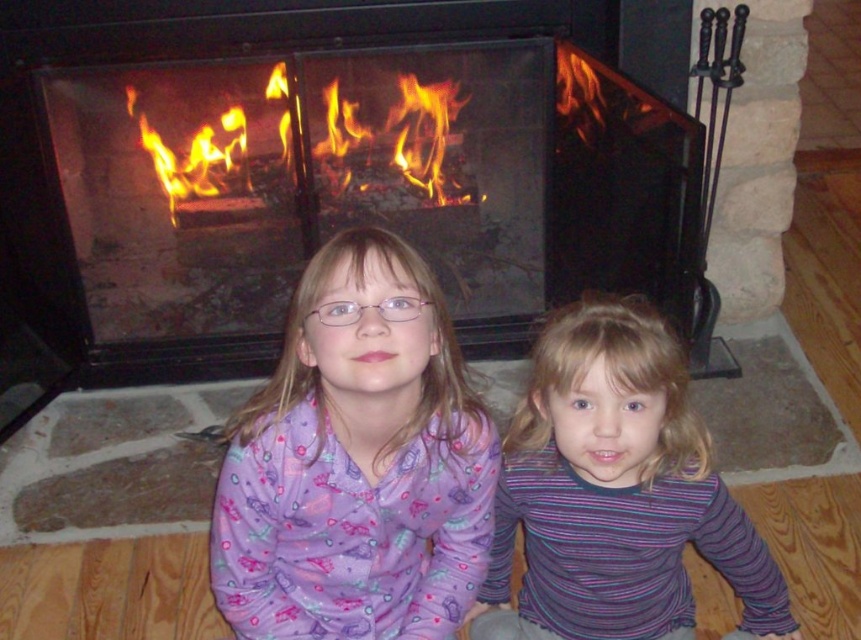
You are standing in a living room and want to place a decorative item on the smooth stone fireplace at center. According to the coordinates provided, where exactly should you place it?

The smooth stone fireplace at center is located at point (321,170), so place the decorative item there.